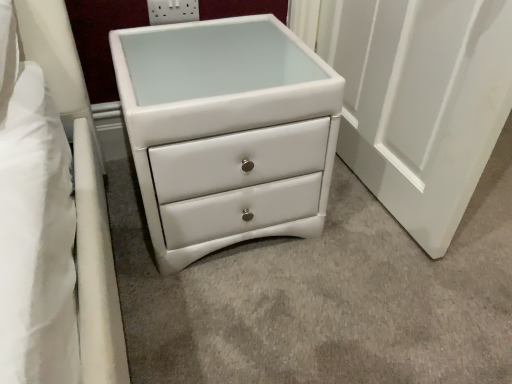
This screenshot has width=512, height=384. I want to click on white plastic socket at upper center, so click(172, 11).

What do you see at coordinates (172, 11) in the screenshot? I see `white plastic socket at upper center` at bounding box center [172, 11].

In order to face white leather chest of drawers at center, should I rotate leftwards or rightwards?

Rotate left and turn 4.808 degrees.

The width and height of the screenshot is (512, 384). What do you see at coordinates (227, 132) in the screenshot?
I see `white leather chest of drawers at center` at bounding box center [227, 132].

Identify the location of white leather chest of drawers at center. The width and height of the screenshot is (512, 384). (227, 132).

Image resolution: width=512 pixels, height=384 pixels. What are the coordinates of `white plastic socket at upper center` in the screenshot? It's located at (172, 11).

Between white plastic socket at upper center and white leather chest of drawers at center, which one appears on the left side from the viewer's perspective?

From the viewer's perspective, white plastic socket at upper center appears more on the left side.

Relative to white leather chest of drawers at center, is white plastic socket at upper center in front or behind?

Visually, white plastic socket at upper center is located behind white leather chest of drawers at center.

Does point (147, 0) come in front of point (297, 154)?

No, it is not.

In the scene shown: From the image's perspective, between white plastic socket at upper center and white leather chest of drawers at center, who is located below?

white leather chest of drawers at center.

From a real-world perspective, is white plastic socket at upper center positioned over white leather chest of drawers at center based on gravity?

Yes, from a real-world perspective, white plastic socket at upper center is above white leather chest of drawers at center.

Is white plastic socket at upper center wider than white leather chest of drawers at center?

In fact, white plastic socket at upper center might be narrower than white leather chest of drawers at center.

Between white plastic socket at upper center and white leather chest of drawers at center, which one has less height?

A: white plastic socket at upper center.

Is white plastic socket at upper center bigger than white leather chest of drawers at center?

No.

Choose the correct answer: Is white plastic socket at upper center inside white leather chest of drawers at center or outside it?

white plastic socket at upper center is not enclosed by white leather chest of drawers at center.

Does white plastic socket at upper center touch white leather chest of drawers at center?

No.

Is white plastic socket at upper center positioned with its back to white leather chest of drawers at center?

No.

Can you tell me how much white plastic socket at upper center and white leather chest of drawers at center differ in facing direction?

They differ by 0.925 degrees in their facing directions.

The width and height of the screenshot is (512, 384). I want to click on electric outlet that appears above the white leather chest of drawers at center (from the image's perspective), so 172,11.

Based on the photo, is white leather chest of drawers at center at the right side of white plastic socket at upper center?

Yes.

Does white leather chest of drawers at center lie behind white plastic socket at upper center?

No, the depth of white leather chest of drawers at center is less than that of white plastic socket at upper center.

Is point (261, 47) less distant than point (163, 22)?

Yes, point (261, 47) is in front of point (163, 22).

From the image's perspective, which one is positioned lower, white leather chest of drawers at center or white plastic socket at upper center?

white leather chest of drawers at center is shown below in the image.

In the scene shown: From a real-world perspective, between white leather chest of drawers at center and white plastic socket at upper center, who is vertically lower?

white leather chest of drawers at center.

Between white leather chest of drawers at center and white plastic socket at upper center, which one has smaller width?

white plastic socket at upper center is thinner.

Considering the sizes of white leather chest of drawers at center and white plastic socket at upper center in the image, is white leather chest of drawers at center taller or shorter than white plastic socket at upper center?

In the image, white leather chest of drawers at center appears to be taller than white plastic socket at upper center.

Can you confirm if white leather chest of drawers at center is bigger than white plastic socket at upper center?

Correct, white leather chest of drawers at center is larger in size than white plastic socket at upper center.

Does white leather chest of drawers at center contain white plastic socket at upper center?

No, white plastic socket at upper center is not inside white leather chest of drawers at center.

Is white leather chest of drawers at center directly adjacent to white plastic socket at upper center?

white leather chest of drawers at center is not next to white plastic socket at upper center, and they're not touching.

Is white plastic socket at upper center at the back of white leather chest of drawers at center?

Yes.

How different are the orientations of white leather chest of drawers at center and white plastic socket at upper center in degrees?

The angle between the facing direction of white leather chest of drawers at center and the facing direction of white plastic socket at upper center is 0.925 degrees.

The height and width of the screenshot is (384, 512). I want to click on the chest of drawers below the white plastic socket at upper center (from the image's perspective), so click(227, 132).

You are a GUI agent. You are given a task and a screenshot of the screen. Output one action in this format:
    pyautogui.click(x=<x>, y=<y>)
    Task: Click on the electric outlet above the white leather chest of drawers at center (from a real-world perspective)
    The width and height of the screenshot is (512, 384).
    Given the screenshot: What is the action you would take?
    pyautogui.click(x=172, y=11)

The height and width of the screenshot is (384, 512). I want to click on the chest of drawers in front of the white plastic socket at upper center, so click(x=227, y=132).